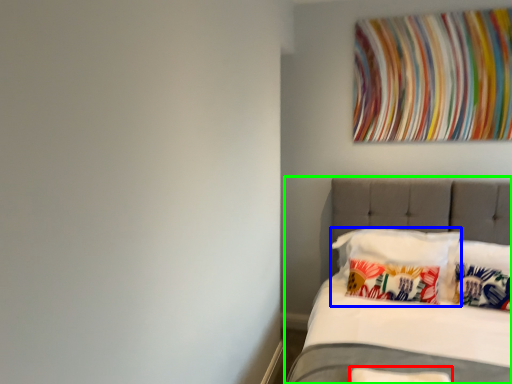
Question: Based on their relative distances, which object is nearer to pillow (highlighted by a red box)? Choose from pillow (highlighted by a blue box) and bed (highlighted by a green box).

Choices:
 (A) pillow
 (B) bed

Answer: (A)